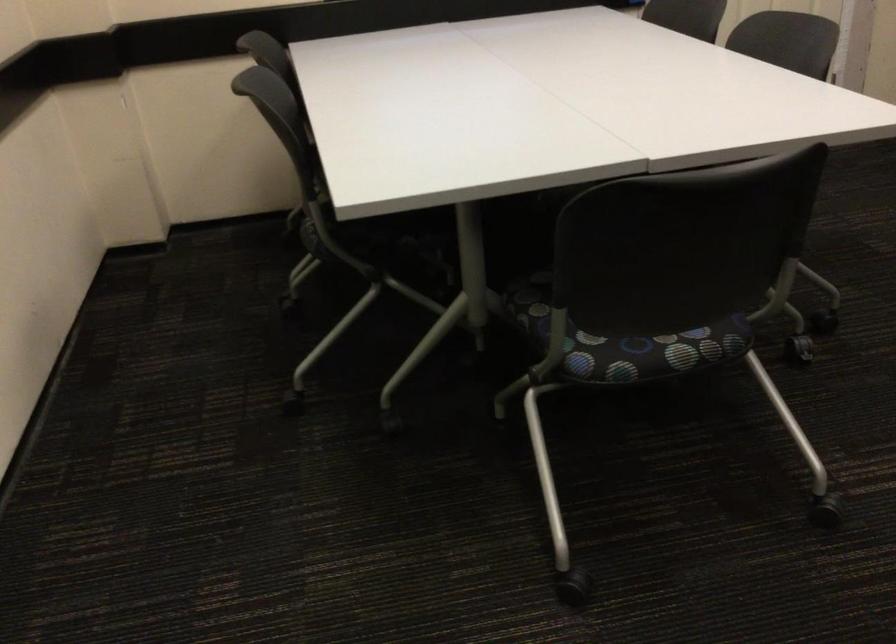
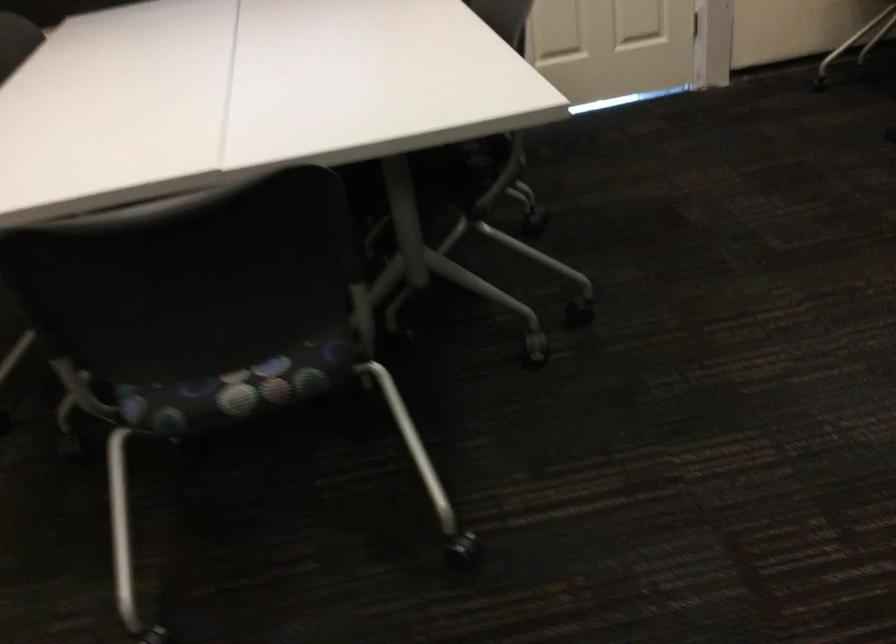
Locate, in the second image, the point that corresponds to the point at 675,348 in the first image.

(234, 389)